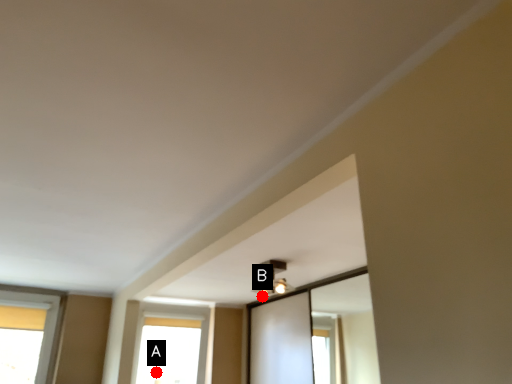
Question: Two points are circled on the image, labeled by A and B beside each circle. Which point is further to the camera?

Choices:
 (A) A is further
 (B) B is further

Answer: (A)